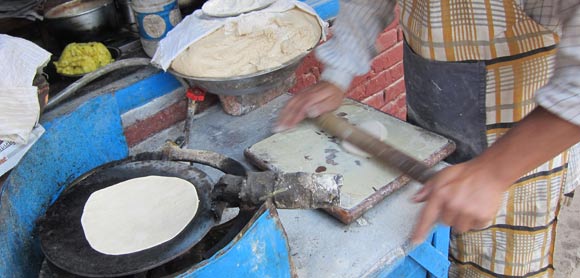
Locate an element on the screen. The image size is (580, 278). hot plate is located at coordinates (137, 206).